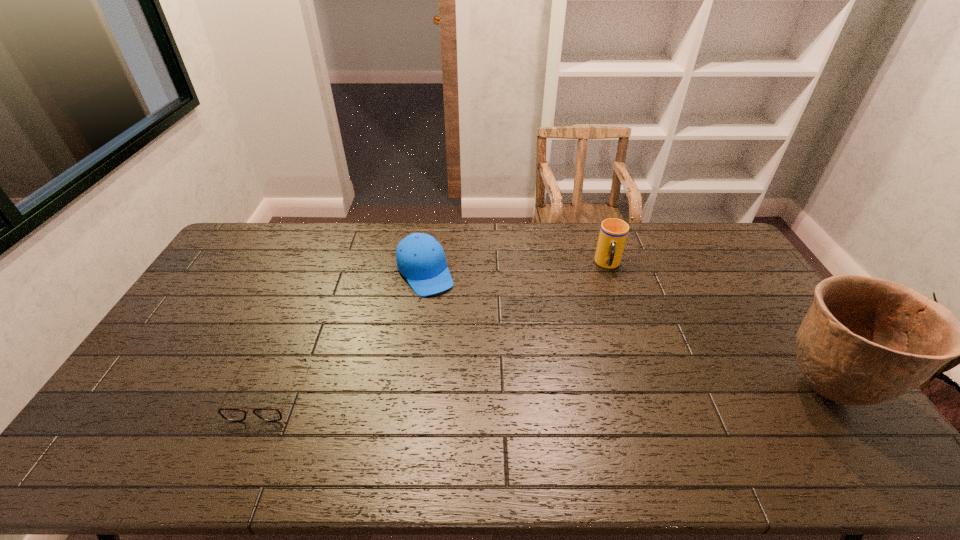
Find the location of `sunglasses`. sunglasses is located at coordinates [231, 414].

Find the location of a particular element. This screenshot has height=540, width=960. the leftmost object is located at coordinates click(231, 414).

The image size is (960, 540). What are the coordinates of `the rightmost object` in the screenshot? It's located at (864, 341).

Identify the location of the tallest object. The image size is (960, 540). (864, 341).

Identify the location of the second object from left to right. The width and height of the screenshot is (960, 540). (420, 258).

In order to click on cap in this screenshot , I will do `click(420, 258)`.

Find the location of a particular element. the second tallest object is located at coordinates (613, 233).

Where is `the second object from right to left`? The width and height of the screenshot is (960, 540). the second object from right to left is located at coordinates (613, 233).

At what (x,y) coordinates should I click in order to perform the action: click on free space located 0.280m on the left of the pottery. Please return your answer as a coordinate pair (x, y). Looking at the image, I should click on (671, 389).

The image size is (960, 540). What are the coordinates of `free location located on the front-facing side of the third object from right to left` in the screenshot? It's located at (452, 322).